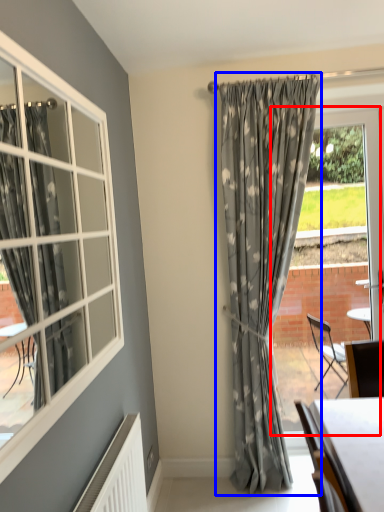
Question: Which point is further to the camera, window frame (highlighted by a red box) or curtain (highlighted by a blue box)?

Choices:
 (A) window frame
 (B) curtain

Answer: (A)